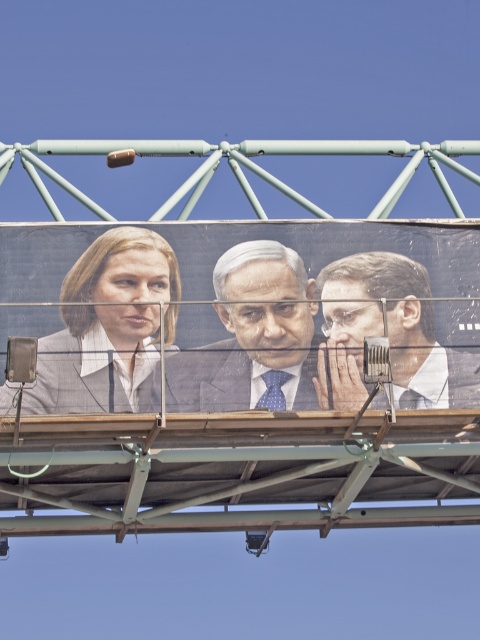
Between matte gray suit at center and smooth gray suit at center, which one appears on the left side from the viewer's perspective?

matte gray suit at center

Who is shorter, matte gray suit at center or smooth gray suit at center?

With less height is smooth gray suit at center.

Is point (82, 285) farther from viewer compared to point (408, 301)?

No, it is not.

This screenshot has height=640, width=480. I want to click on matte gray suit at center, so click(x=108, y=324).

Can you confirm if matte plastic billboard at center is thinner than matte gray suit at center?

No, matte plastic billboard at center is not thinner than matte gray suit at center.

Measure the distance between point (97, 300) and camera.

Point (97, 300) and camera are 70.45 meters apart.

Which is in front, point (327, 356) or point (84, 324)?

Positioned in front is point (327, 356).

At what (x,y) coordinates should I click in order to perform the action: click on matte plastic billboard at center. Please return your answer as a coordinate pair (x, y). The height and width of the screenshot is (640, 480). Looking at the image, I should click on (240, 312).

Is blue dotted tie at center to the right of smooth gray suit at center from the viewer's perspective?

In fact, blue dotted tie at center is to the left of smooth gray suit at center.

Where is `blue dotted tie at center`? The image size is (480, 640). blue dotted tie at center is located at coordinates (252, 337).

Where is `blue dotted tie at center`? Image resolution: width=480 pixels, height=640 pixels. blue dotted tie at center is located at coordinates (252, 337).

Where is `blue dotted tie at center`? blue dotted tie at center is located at coordinates (252, 337).